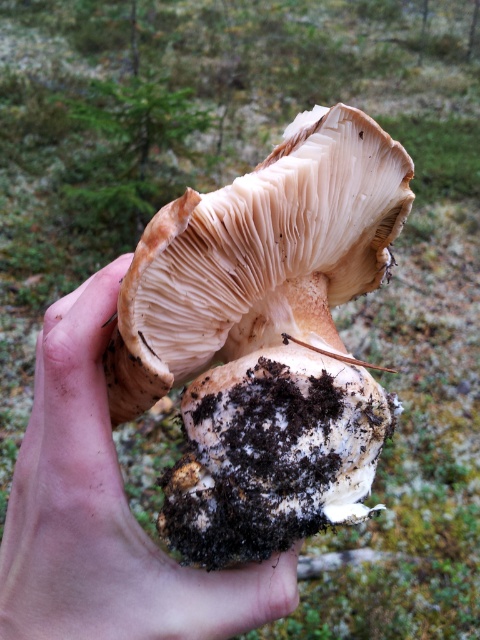
You are a mycologist examining a mushroom specimen. You need to place it on a 15 inch wide tray. Can you determine if the brown fibrous mushroom at center will fit on the tray based on its size?

The brown fibrous mushroom at center is 17.06 inches from viewer, which is wider than the 15 inch tray. Therefore, it will not fit on the tray.

In the scene shown: You are a photographer trying to focus on two points in the image of a hand holding a mushroom. The first point is at coordinates point (196, 257) and the second is at point (95, 508). Which point is closer to your camera lens?

Point (196, 257) is further to the viewer than point (95, 508), so the second point is closer to the camera lens.

You are a botanist studying mushroom growth patterns. You have a map of the forest where the mushroom was found, with coordinates marked. The map shows the mushroom at coordinates 0.530, 0.552. If you want to place a marker exactly where the brown fibrous mushroom at center is located, what coordinates should you use?

The brown fibrous mushroom at center is located at coordinates (264, 339), so you should place the marker at those coordinates.